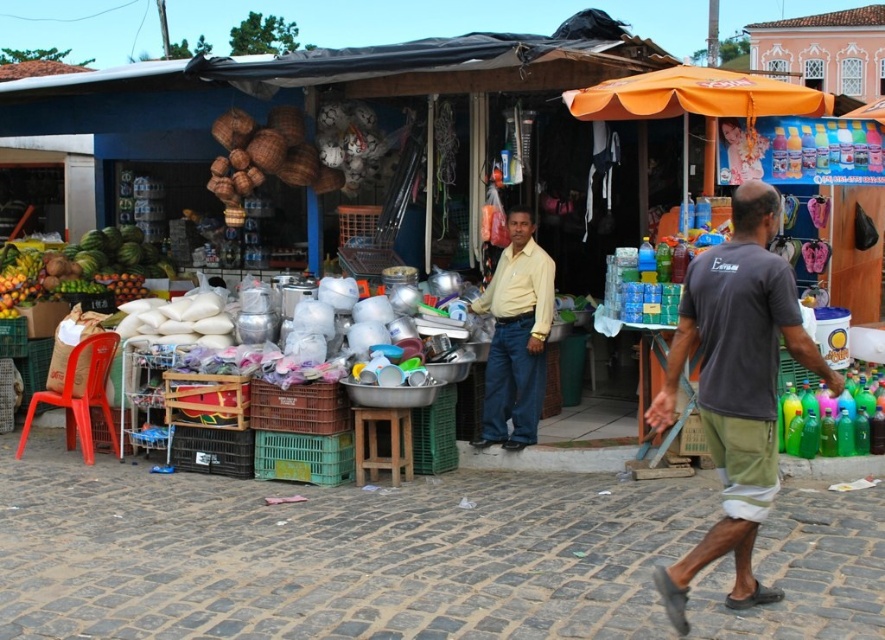
You are a photographer trying to capture the yellow matte shirt at center and the shiny green watermelon at left in the same frame. Since the sunlight is very bright, you want to adjust your camera to focus on the closest object. Which object should you focus on?

The yellow matte shirt at center is in front of the shiny green watermelon at left, so you should focus on the yellow matte shirt at center as it is closer.